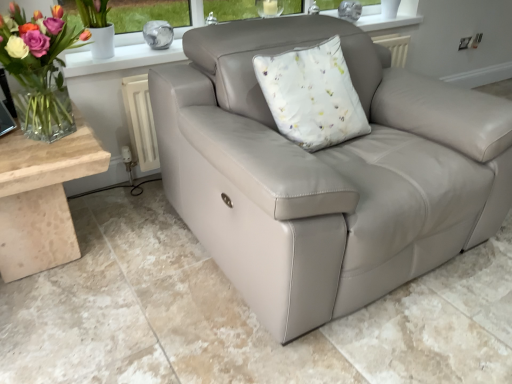
I want to click on free space in front of beige marble table at lower left, so click(71, 333).